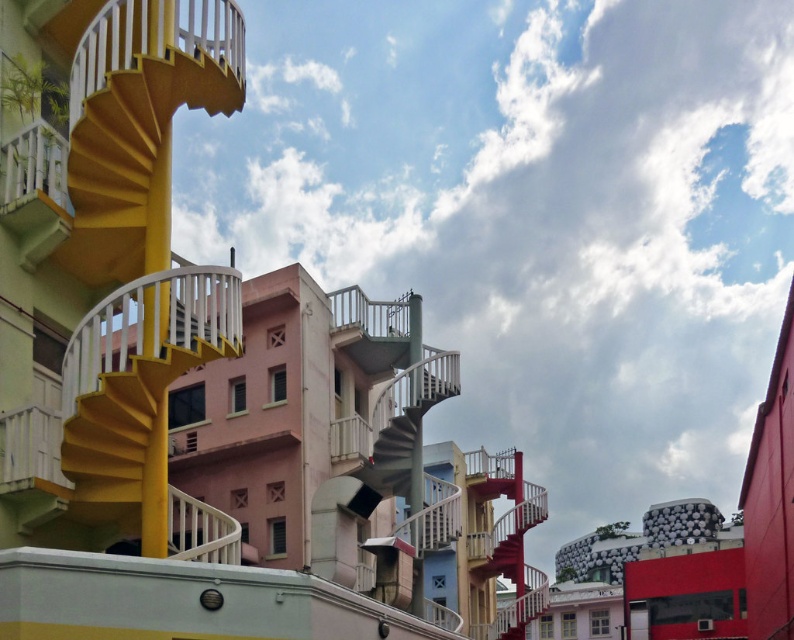
Who is shorter, yellow matte spiral staircase at left or metallic yellow spiral staircase at left?

metallic yellow spiral staircase at left

Does yellow matte spiral staircase at left come in front of metallic yellow spiral staircase at left?

Yes, yellow matte spiral staircase at left is closer to the viewer.

At what (x,y) coordinates should I click in order to perform the action: click on yellow matte spiral staircase at left. Please return your answer as a coordinate pair (x, y). Looking at the image, I should click on (199, 378).

You are a GUI agent. You are given a task and a screenshot of the screen. Output one action in this format:
    pyautogui.click(x=<x>, y=<y>)
    Task: Click on the yellow matte spiral staircase at left
    This screenshot has height=640, width=794.
    Given the screenshot: What is the action you would take?
    pyautogui.click(x=199, y=378)

Is yellow matte spiral staircase at left to the left of metallic gray staircase at center from the viewer's perspective?

Yes, yellow matte spiral staircase at left is to the left of metallic gray staircase at center.

Who is shorter, yellow matte spiral staircase at left or metallic gray staircase at center?

metallic gray staircase at center is shorter.

Does point (229, 538) come closer to viewer compared to point (387, 468)?

Yes, it is in front of point (387, 468).

Identify the location of yellow matte spiral staircase at left. Image resolution: width=794 pixels, height=640 pixels. (199, 378).

Who is higher up, metallic yellow spiral staircase at left or metallic gray staircase at center?

Positioned higher is metallic yellow spiral staircase at left.

How far apart are metallic yellow spiral staircase at left and metallic gray staircase at center?

metallic yellow spiral staircase at left and metallic gray staircase at center are 68.69 feet apart.

Is point (207, 266) more distant than point (384, 390)?

No, (207, 266) is in front of (384, 390).

This screenshot has height=640, width=794. Identify the location of metallic yellow spiral staircase at left. (137, 392).